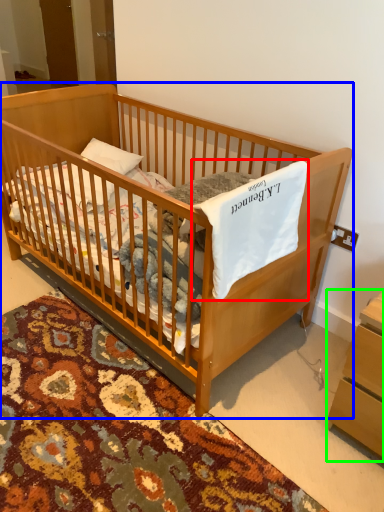
Question: Which is nearer to the sheet (highlighted by a red box)? infant bed (highlighted by a blue box) or changing table (highlighted by a green box).

Choices:
 (A) infant bed
 (B) changing table

Answer: (A)